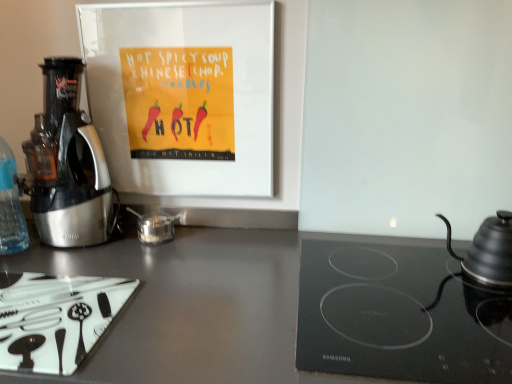
At what (x,y) coordinates should I click in order to perform the action: click on vacant area on top of black glass cooktop at lower right (from a real-world perspective). Please return your answer as a coordinate pair (x, y). The width and height of the screenshot is (512, 384). Looking at the image, I should click on (395, 293).